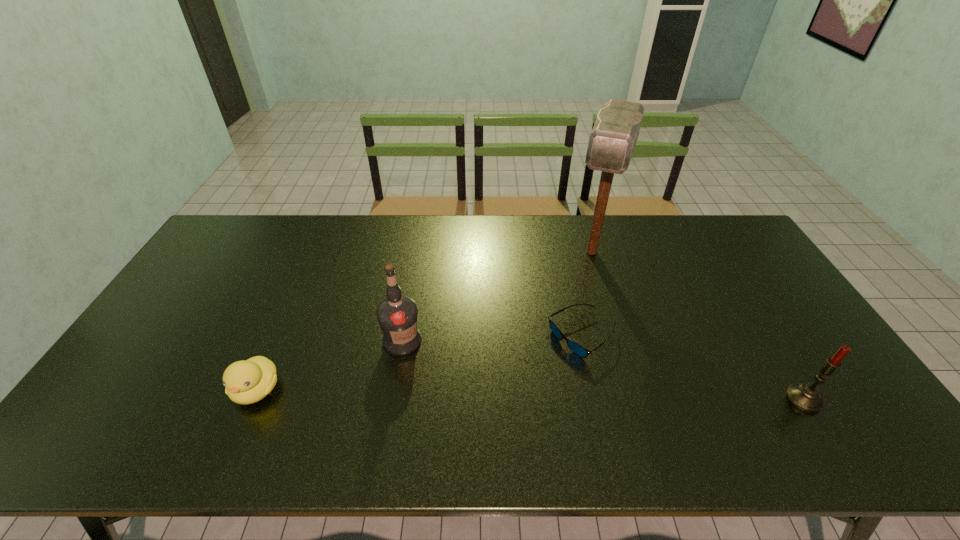
This screenshot has width=960, height=540. I want to click on vacant space located 0.220m on the striking face of the mallet, so click(x=571, y=322).

Locate an element on the screen. The image size is (960, 540). vacant area situated 0.320m on the striking face of the mallet is located at coordinates (564, 347).

Where is `vacant space located on the striking face of the mallet`? The width and height of the screenshot is (960, 540). vacant space located on the striking face of the mallet is located at coordinates (565, 339).

I want to click on free point located 0.170m on the front label of the second object from left to right, so click(463, 384).

Locate an element on the screen. This screenshot has width=960, height=540. vacant region located 0.180m on the front label of the second object from left to right is located at coordinates (466, 386).

This screenshot has width=960, height=540. I want to click on vacant space located on the front label of the second object from left to right, so (x=445, y=372).

You are a GUI agent. You are given a task and a screenshot of the screen. Output one action in this format:
    pyautogui.click(x=<x>, y=<y>)
    Task: Click on the free space located 0.150m at the front of the shortest object showing the lenses
    
    Given the screenshot: What is the action you would take?
    pyautogui.click(x=567, y=410)

Locate an element on the screen. free space located at the front of the shortest object showing the lenses is located at coordinates (572, 387).

Identify the location of vacant point located 0.080m at the front of the shortest object showing the lenses. The image size is (960, 540). (572, 387).

Locate an element on the screen. This screenshot has height=540, width=960. object at the far edge is located at coordinates (611, 144).